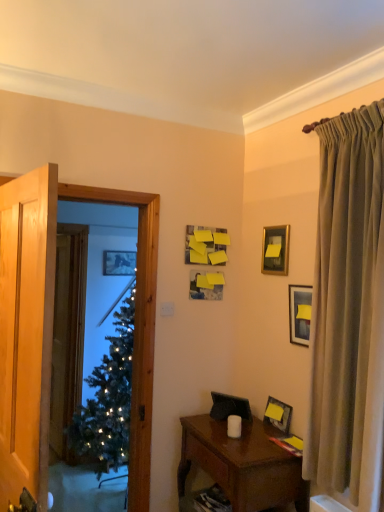
This screenshot has width=384, height=512. Find the location of `vacant area that is in front of white matte candle at center`. vacant area that is in front of white matte candle at center is located at coordinates (241, 449).